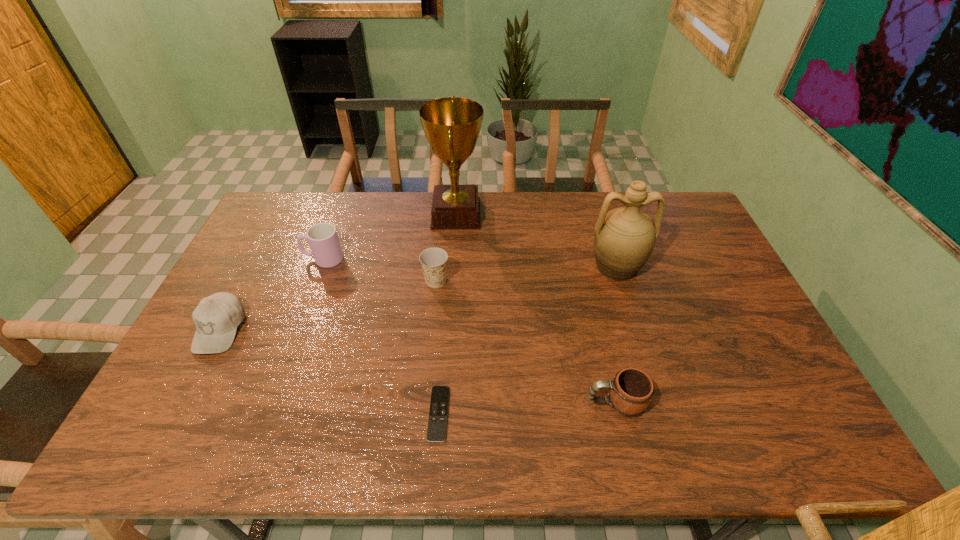
Point out which object is positioned as the nearest to the sixth object from right to left. Please provide its 2D coordinates. Your answer should be formatted as a tuple, i.e. [(x, y)], where the tuple contains the x and y coordinates of a point satisfying the conditions above.

[(216, 318)]

The height and width of the screenshot is (540, 960). I want to click on vacant area that satisfies the following two spatial constraints: 1. on the plaque of the award; 2. on the back side of the sixth shortest object, so click(x=453, y=266).

The width and height of the screenshot is (960, 540). I want to click on vacant region that satisfies the following two spatial constraints: 1. on the side of the mug with the handle; 2. on the front side of the shortest object, so click(618, 414).

Locate an element on the screen. The image size is (960, 540). free space that satisfies the following two spatial constraints: 1. on the plaque of the award; 2. on the front-facing side of the leftmost object is located at coordinates (449, 329).

Find the location of `vacant space that satisfies the following two spatial constraints: 1. on the plaque of the award; 2. on the front-facing side of the fifth farthest object`. vacant space that satisfies the following two spatial constraints: 1. on the plaque of the award; 2. on the front-facing side of the fifth farthest object is located at coordinates (449, 329).

The image size is (960, 540). I want to click on vacant space that satisfies the following two spatial constraints: 1. on the plaque of the tallest object; 2. on the right side of the pitcher, so click(453, 266).